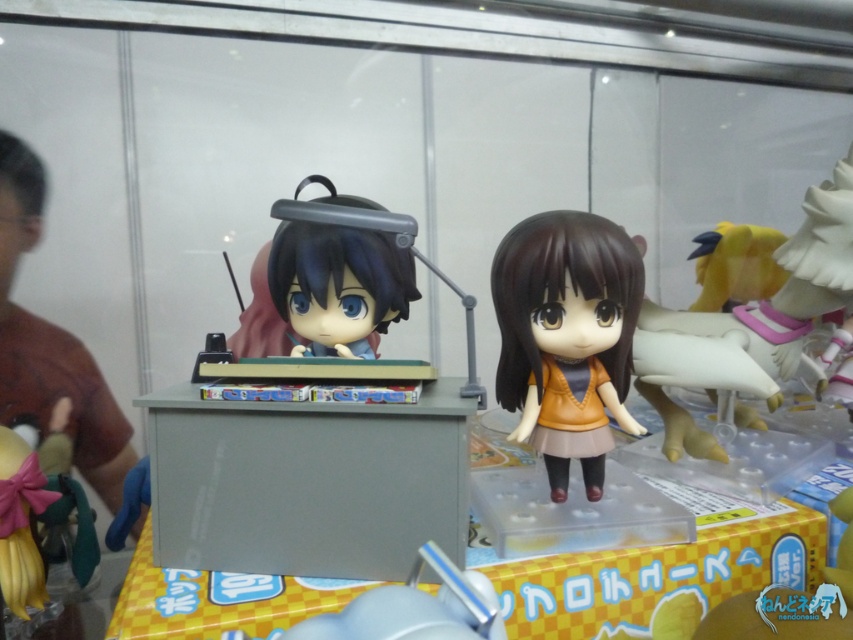
What are the coordinates of the brown matte doll at center?

The brown matte doll at center is located at coordinates point [566,321].

You are at an anime convention and want to take a photo of the two points marked on the display table. Which point, point [334,250] or point [734,241], is closer to you?

Point [334,250] is closer to the viewer than point [734,241].

You are organizing a display for a convention and have a shelf that can only accommodate items narrower than the satin black hair clip at center. Can the brown matte doll at center fit on this shelf?

The brown matte doll at center is narrower than the satin black hair clip at center, so it can fit on the shelf.